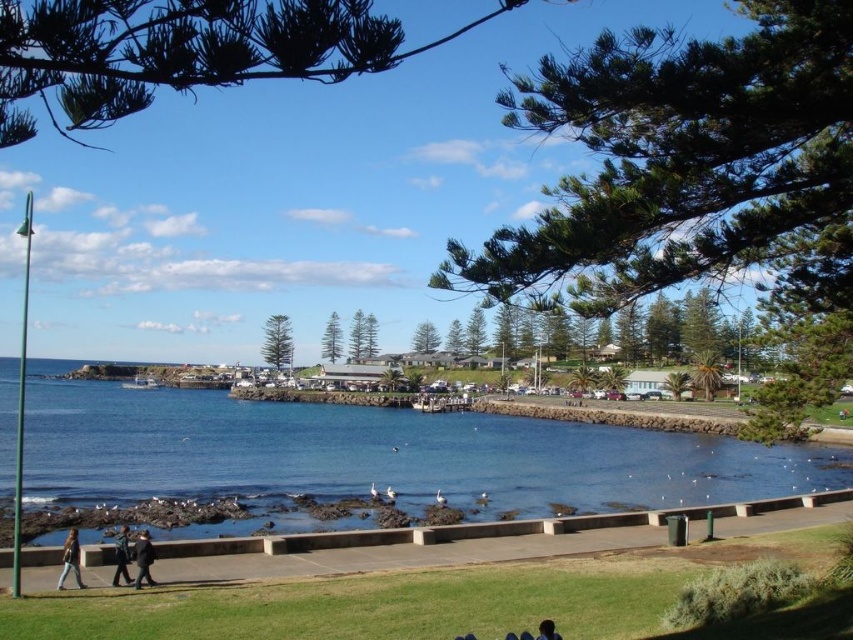
Is blue water at center above dark gray jacket at lower left?

Incorrect, blue water at center is not positioned above dark gray jacket at lower left.

Looking at this image, who is more distant from viewer, (628, 480) or (144, 541)?

Positioned behind is point (628, 480).

Identify the location of blue water at center. This screenshot has height=640, width=853. (378, 454).

Can you confirm if dark gray jacket at lower left is taller than dark blue jeans at lower left?

Yes.

The width and height of the screenshot is (853, 640). Find the location of `dark gray jacket at lower left`. dark gray jacket at lower left is located at coordinates (143, 557).

I want to click on dark gray jacket at lower left, so click(x=143, y=557).

Can you confirm if denim jacket at lower left is bigger than dark gray jacket at lower left?

Actually, denim jacket at lower left might be smaller than dark gray jacket at lower left.

How distant is denim jacket at lower left from dark gray jacket at lower left?

denim jacket at lower left is 5.15 feet from dark gray jacket at lower left.

Is point (67, 541) positioned before point (138, 580)?

No.

Find the location of `denim jacket at lower left`. denim jacket at lower left is located at coordinates (70, 560).